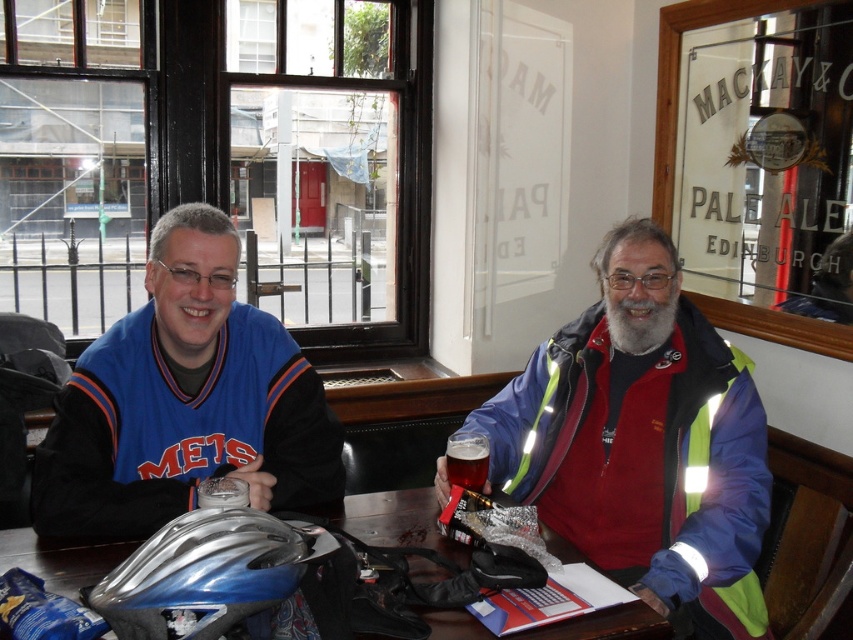
Is blue jersey at left wider than reflective blue jacket at right?

Incorrect, blue jersey at left's width does not surpass reflective blue jacket at right's.

Who is more forward, (680, 461) or (614, 497)?

Positioned in front is point (680, 461).

Between point (686, 326) and point (683, 579), which one is positioned behind?

Point (686, 326)

This screenshot has height=640, width=853. What are the coordinates of `blue jersey at left` in the screenshot? It's located at (643, 442).

Which is in front, point (550, 529) or point (215, 456)?

Positioned in front is point (550, 529).

At what (x,y) coordinates should I click in order to perform the action: click on blue jersey at left. Please return your answer as a coordinate pair (x, y). The width and height of the screenshot is (853, 640). Looking at the image, I should click on (643, 442).

Between metallic blue helmet at center and amber glass beer at center, which one is positioned lower?

metallic blue helmet at center is lower down.

Is metallic blue helmet at center thinner than amber glass beer at center?

No.

Which is behind, point (51, 570) or point (480, 451)?

Point (480, 451)

This screenshot has height=640, width=853. What are the coordinates of `metallic blue helmet at center` in the screenshot? It's located at 398,520.